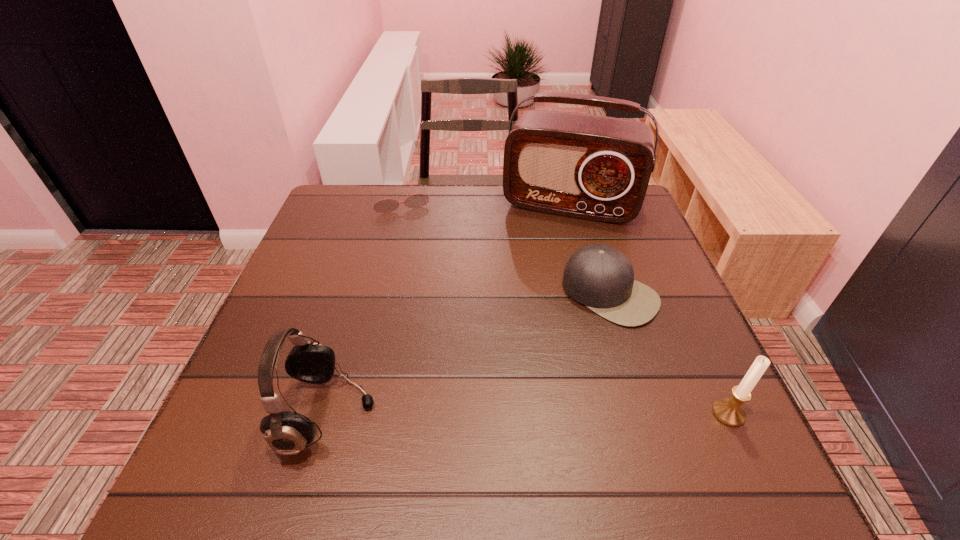
Find the location of a particular element. candle holder at the near edge is located at coordinates (730, 412).

You are a GUI agent. You are given a task and a screenshot of the screen. Output one action in this format:
    pyautogui.click(x=<x>, y=<y>)
    Task: Click on the headset that is positioned at the left edge
    This screenshot has height=540, width=960.
    Given the screenshot: What is the action you would take?
    click(287, 433)

Where is `sunglasses present at the left edge`? This screenshot has width=960, height=540. sunglasses present at the left edge is located at coordinates (417, 200).

Locate an element on the screen. The width and height of the screenshot is (960, 540). candle holder positioned at the right edge is located at coordinates (730, 412).

Locate an element on the screen. This screenshot has height=540, width=960. cap situated at the right edge is located at coordinates coord(600,277).

Where is `radio receiver at the right edge`? The height and width of the screenshot is (540, 960). radio receiver at the right edge is located at coordinates (592, 167).

At what (x,y) coordinates should I click in order to perform the action: click on object that is at the far left corner. Please return your answer as a coordinate pair (x, y). This screenshot has height=540, width=960. Looking at the image, I should click on (417, 200).

Where is `object at the near left corner`? The width and height of the screenshot is (960, 540). object at the near left corner is located at coordinates (287, 433).

Find the location of `object located in the far right corner section of the desktop`. object located in the far right corner section of the desktop is located at coordinates (x=592, y=167).

The image size is (960, 540). Identify the location of object present at the near right corner. (730, 412).